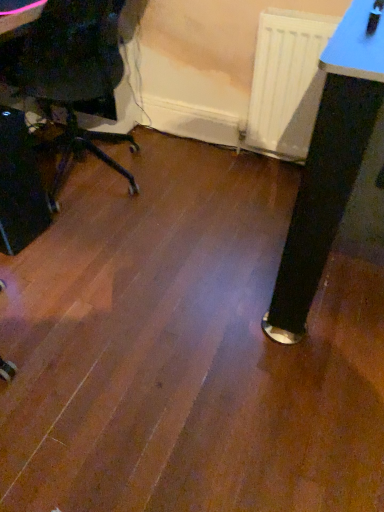
Question: From the image's perspective, is white matte radiator at center above or below black plastic computer tower at left?

Choices:
 (A) above
 (B) below

Answer: (A)

Question: Based on their sizes in the image, would you say white matte radiator at center is bigger or smaller than black plastic computer tower at left?

Choices:
 (A) small
 (B) big

Answer: (A)

Question: In terms of width, does white matte radiator at center look wider or thinner when compared to black plastic computer tower at left?

Choices:
 (A) wide
 (B) thin

Answer: (B)

Question: Based on their sizes in the image, would you say black plastic computer tower at left is bigger or smaller than white matte radiator at center?

Choices:
 (A) small
 (B) big

Answer: (B)

Question: From their relative heights in the image, would you say black plastic computer tower at left is taller or shorter than white matte radiator at center?

Choices:
 (A) short
 (B) tall

Answer: (A)

Question: Is black plastic computer tower at left inside or outside of white matte radiator at center?

Choices:
 (A) inside
 (B) outside

Answer: (B)

Question: From the image's perspective, relative to white matte radiator at center, is black plastic computer tower at left above or below?

Choices:
 (A) below
 (B) above

Answer: (A)